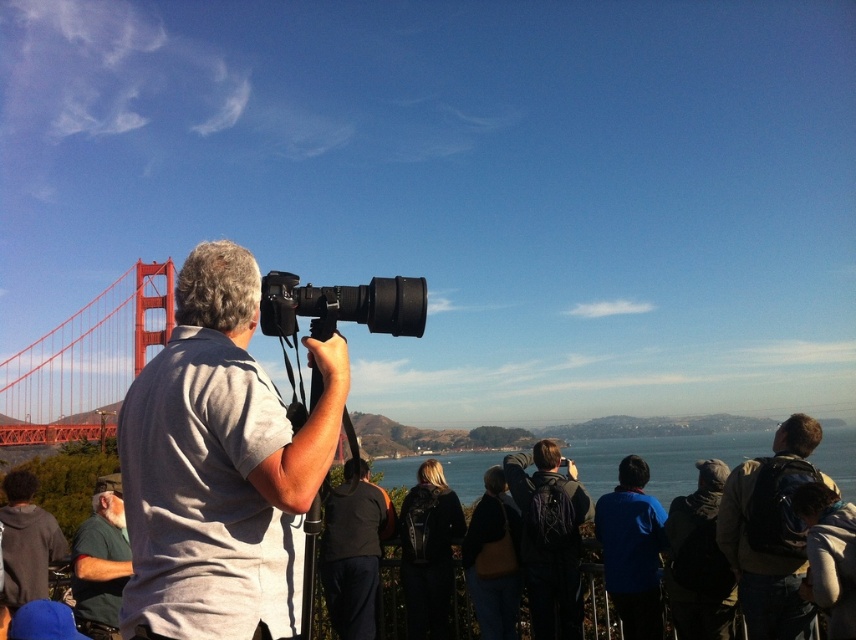
Is point (238, 529) closer to viewer compared to point (113, 524)?

That is True.

Does point (283, 419) come closer to viewer compared to point (110, 499)?

Yes, point (283, 419) is in front of point (110, 499).

At what (x,y) coordinates should I click in order to perform the action: click on gray fabric shirt at center. Please return your answer as a coordinate pair (x, y). Looking at the image, I should click on (218, 465).

Is the position of black plastic camera at center more distant than that of dark gray hoodie at lower left?

That is False.

Is point (381, 310) positioned behind point (28, 472)?

No, (381, 310) is closer to viewer.

Find the location of a particular element. black plastic camera at center is located at coordinates (342, 305).

The image size is (856, 640). What do you see at coordinates (218, 465) in the screenshot? I see `gray fabric shirt at center` at bounding box center [218, 465].

Does gray fabric shirt at center have a larger size compared to dark gray hoodie at lower left?

Yes, gray fabric shirt at center is bigger than dark gray hoodie at lower left.

What are the coordinates of `gray fabric shirt at center` in the screenshot? It's located at (218, 465).